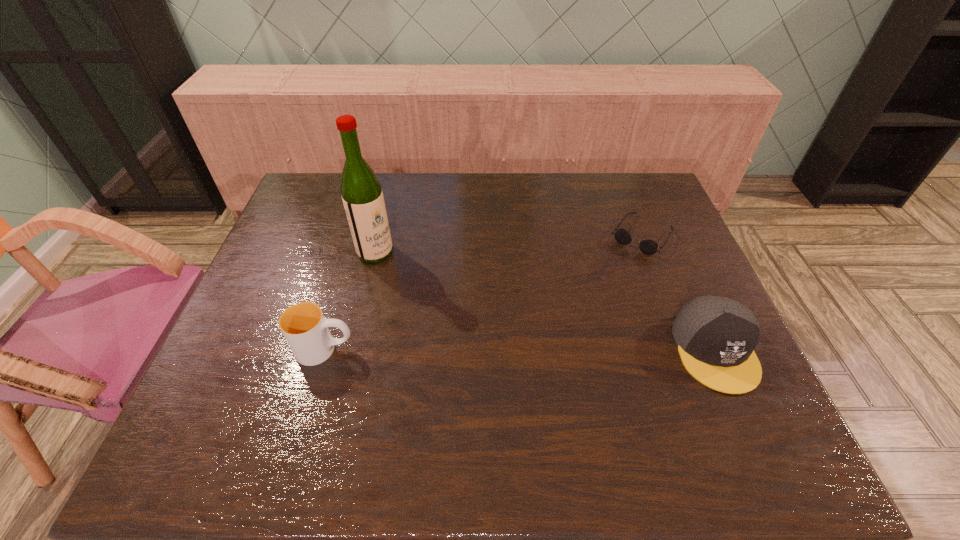
At what (x,y) coordinates should I click in order to perform the action: click on free space on the desktop that is between the cup and the cap and is positioned on the label of the tallest object. Please return your answer as a coordinate pair (x, y). This screenshot has width=960, height=540. Looking at the image, I should click on point(512,350).

Identify the location of vacant spot on the desktop that is between the cup and the cap and is positioned on the front-facing side of the shortest object. click(561, 350).